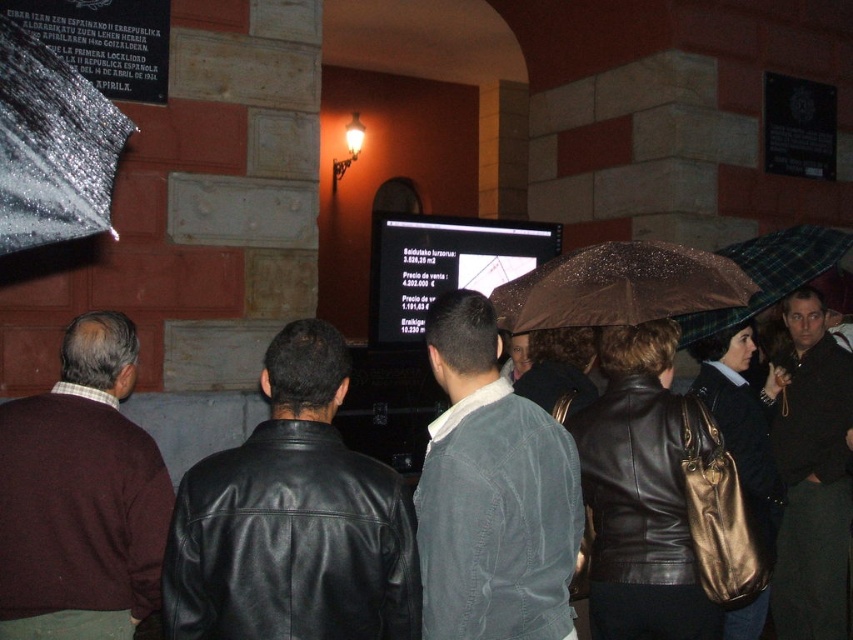
Question: Is maroon sweater at left below dark gray corduroy jacket at center?

Choices:
 (A) no
 (B) yes

Answer: (B)

Question: Among these objects, which one is nearest to the camera?

Choices:
 (A) black leather jacket at center
 (B) brown shiny umbrella at center
 (C) dark gray corduroy jacket at center
 (D) shiny metallic umbrella at upper left

Answer: (D)

Question: Considering the real-world distances, which object is farthest from the plaid fabric umbrella at right?

Choices:
 (A) dark gray leather jacket at right
 (B) black leather jacket at center
 (C) shiny metallic umbrella at upper left
 (D) brown shiny umbrella at center

Answer: (C)

Question: Which object is positioned closest to the black leather jacket at center?

Choices:
 (A) dark gray leather jacket at right
 (B) brown shiny umbrella at center
 (C) shiny metallic umbrella at upper left
 (D) dark gray corduroy jacket at center

Answer: (D)

Question: Is dark gray corduroy jacket at center further to camera compared to shiny metallic umbrella at upper left?

Choices:
 (A) yes
 (B) no

Answer: (A)

Question: Does maroon sweater at left have a lesser width compared to brown shiny umbrella at center?

Choices:
 (A) no
 (B) yes

Answer: (B)